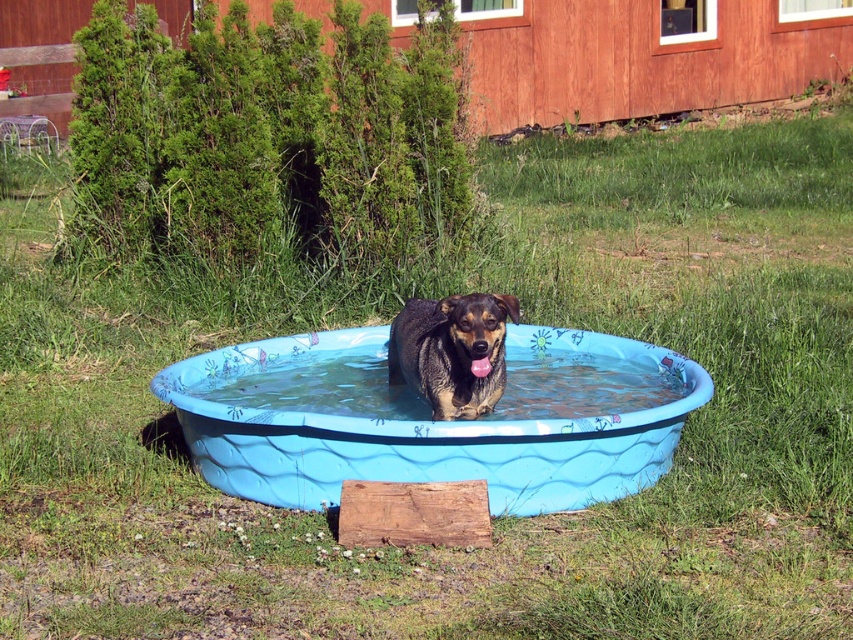
Question: Which point appears farthest from the camera in this image?

Choices:
 (A) (293, 417)
 (B) (283, 360)

Answer: (B)

Question: Which is nearer to the brown fur dog at center?

Choices:
 (A) blue plastic water at center
 (B) blue plastic tub at center

Answer: (A)

Question: Does blue plastic tub at center have a smaller size compared to blue plastic water at center?

Choices:
 (A) no
 (B) yes

Answer: (A)

Question: Considering the relative positions of blue plastic water at center and brown fur dog at center in the image provided, where is blue plastic water at center located with respect to brown fur dog at center?

Choices:
 (A) right
 (B) left

Answer: (A)

Question: Can you confirm if blue plastic tub at center is smaller than blue plastic water at center?

Choices:
 (A) yes
 (B) no

Answer: (B)

Question: Which of the following is the farthest from the observer?

Choices:
 (A) blue plastic water at center
 (B) blue plastic tub at center

Answer: (A)